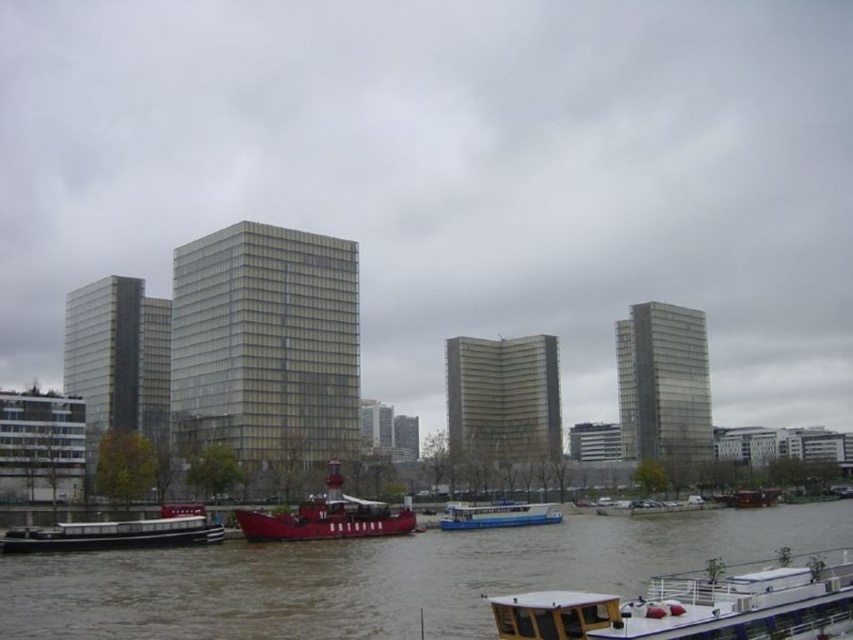
Question: Is wooden deck boat at lower right closer to the viewer compared to shiny red boat at center?

Choices:
 (A) no
 (B) yes

Answer: (B)

Question: Can you confirm if wooden deck boat at lower right is positioned to the right of shiny red boat at center?

Choices:
 (A) no
 (B) yes

Answer: (B)

Question: Which point appears farthest from the camera in this image?

Choices:
 (A) (560, 620)
 (B) (88, 541)
 (C) (541, 515)
 (D) (306, 580)

Answer: (C)

Question: Which point is closer to the camera taking this photo?

Choices:
 (A) (521, 554)
 (B) (73, 534)
 (C) (335, 522)

Answer: (B)

Question: Does brown matte water at lower center appear on the left side of wooden deck boat at lower right?

Choices:
 (A) yes
 (B) no

Answer: (B)

Question: Which is farther from the wooden deck boat at lower right?

Choices:
 (A) matte black boat at lower left
 (B) white glossy boat at center
 (C) brown matte water at lower center

Answer: (B)